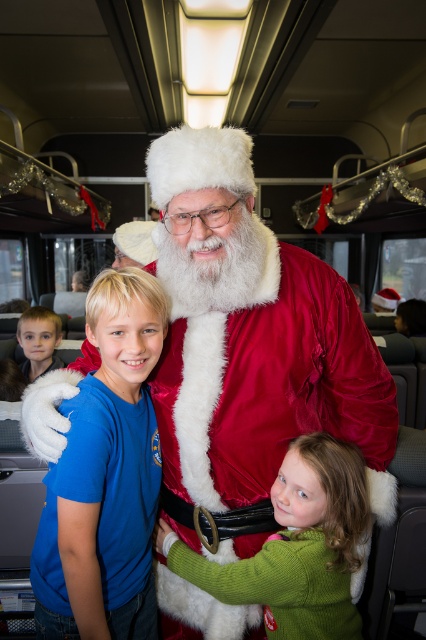
You are a photographer positioned at the center of the train car. You want to take a photo of the velvet red santa at center. According to the scene description, where should you aim your camera to capture the santa in the image?

You should aim your camera at the point with coordinates 0.539 on the x axis and 0.589 on the y axis to capture the velvet red santa at center.

You are a photographer positioned to the right of the scene. You want to take a photo of the velvet red santa at center and the green fuzzy sweater at lower center. Which object should you move closer to the right side to ensure both are centered in your frame?

The velvet red santa at center is to the left of green fuzzy sweater at lower center, so you should move the velvet red santa at center closer to the right side to center both objects in the frame.